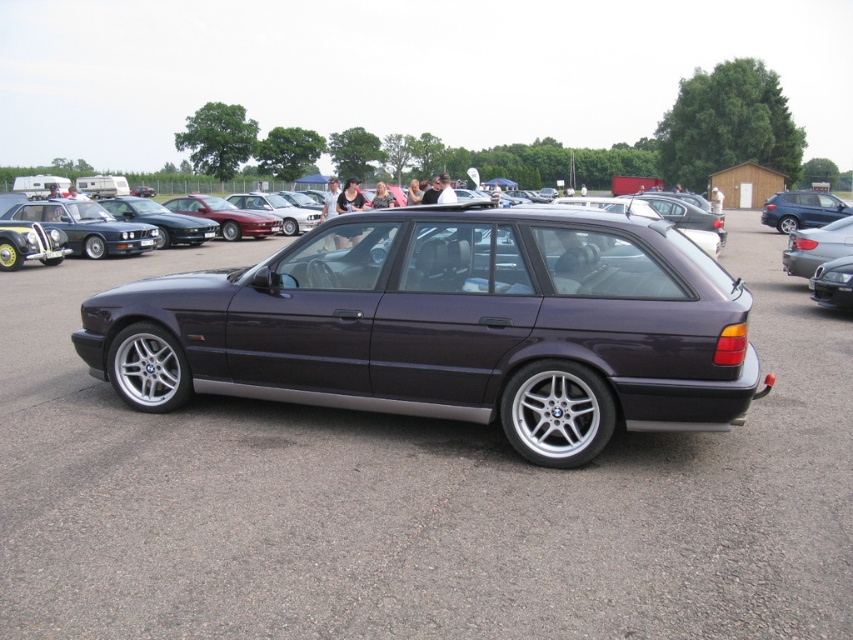
You are a photographer at the car show and want to capture both the silver metallic rim at lower center and the satin blue wagon at right in a single shot. Which object should you focus on first to ensure both are in frame?

The silver metallic rim at lower center is shorter than the satin blue wagon at right, so you should focus on the satin blue wagon at right first to ensure both are in frame.

You are standing in front of the BMW E34 Touring station wagon at the car show. You notice two points marked on the car, one at point coordinates [796,202] and the other at [827,259]. Which point is closer to you?

Point coordinates [796,202] is further to the camera than point coordinates [827,259]. Therefore, the point at [827,259] is closer to you.

You are standing at the car show and want to locate the metallic gray car at center. What are the coordinates where you should look to find it?

The metallic gray car at center is located at coordinates point (415,499).